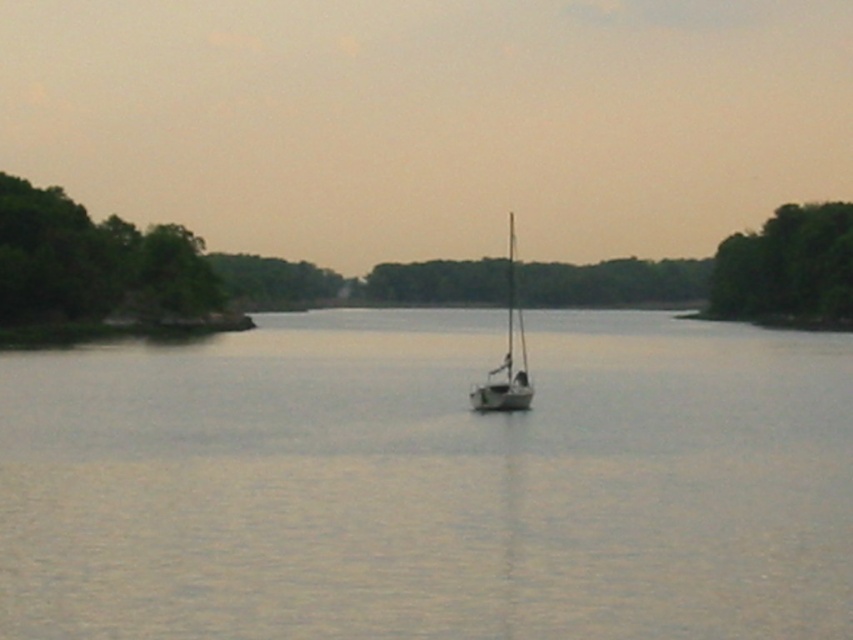
Who is lower down, white smooth water at center or green leafy trees at left?

white smooth water at center is below.

Is white smooth water at center bigger than green leafy trees at left?

Correct, white smooth water at center is larger in size than green leafy trees at left.

The width and height of the screenshot is (853, 640). Identify the location of white smooth water at center. (430, 483).

At what (x,y) coordinates should I click in order to perform the action: click on white smooth water at center. Please return your answer as a coordinate pair (x, y). Looking at the image, I should click on (430, 483).

Is white smooth water at center wider than green leafy trees at right?

Yes, white smooth water at center is wider than green leafy trees at right.

Is white smooth water at center above green leafy trees at right?

Incorrect, white smooth water at center is not positioned above green leafy trees at right.

Does point (33, 368) come in front of point (733, 280)?

Yes, point (33, 368) is in front of point (733, 280).

Where is `white smooth water at center`? white smooth water at center is located at coordinates (430, 483).

Is point (25, 256) closer to viewer compared to point (770, 252)?

Yes, it is.

Find the location of `green leafy trees at left`. green leafy trees at left is located at coordinates (94, 262).